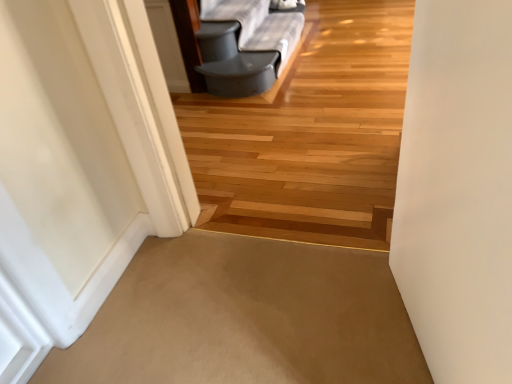
Question: From a real-world perspective, is beige carpet at center, the 2th path viewed from the top, positioned above or below wooden floor at center, the first path from the top?

Choices:
 (A) below
 (B) above

Answer: (A)

Question: Based on their sizes in the image, would you say beige carpet at center, the 1th path ordered from the bottom, is bigger or smaller than wooden floor at center, the first path from the top?

Choices:
 (A) big
 (B) small

Answer: (B)

Question: Is beige carpet at center, the 1th path ordered from the bottom, to the left or to the right of wooden floor at center, the 2th path when ordered from bottom to top, in the image?

Choices:
 (A) right
 (B) left

Answer: (B)

Question: From the image's perspective, is wooden floor at center, the 2th path when ordered from bottom to top, above or below beige carpet at center, the 1th path ordered from the bottom?

Choices:
 (A) above
 (B) below

Answer: (A)

Question: Does point (254, 109) appear closer or farther from the camera than point (82, 374)?

Choices:
 (A) closer
 (B) farther

Answer: (B)

Question: Is wooden floor at center, the 2th path when ordered from bottom to top, inside the boundaries of beige carpet at center, the 2th path viewed from the top, or outside?

Choices:
 (A) outside
 (B) inside

Answer: (A)

Question: In the image, is wooden floor at center, the 2th path when ordered from bottom to top, on the left side or the right side of beige carpet at center, the 1th path ordered from the bottom?

Choices:
 (A) right
 (B) left

Answer: (A)